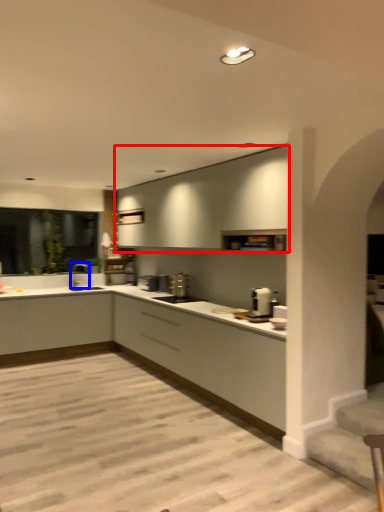
Question: Among these objects, which one is nearest to the camera, cabinetry (highlighted by a red box) or tap (highlighted by a blue box)?

Choices:
 (A) cabinetry
 (B) tap

Answer: (A)